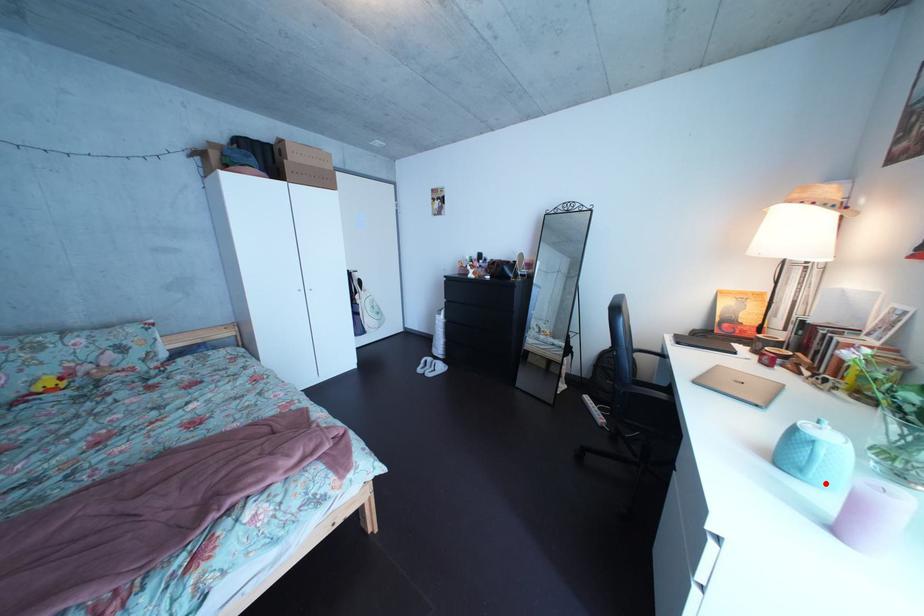
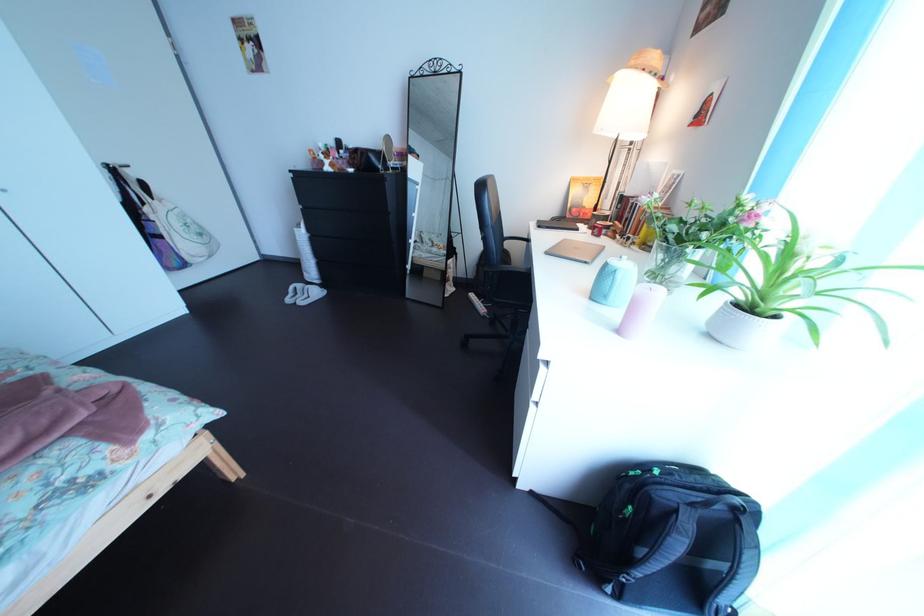
Find the pixel in the second image that matches the highlighted location in the first image.

(626, 307)